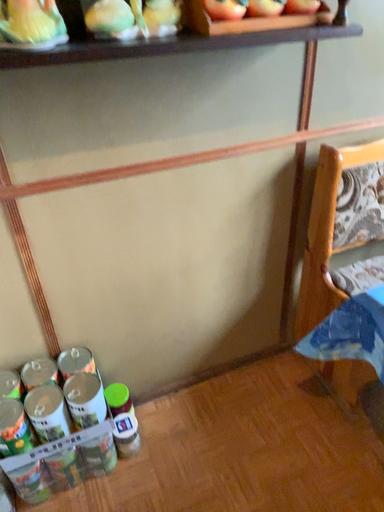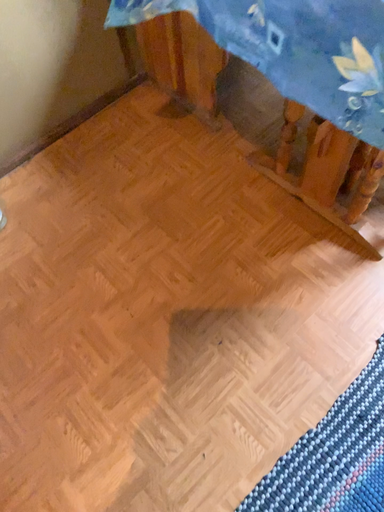
Question: How did the camera likely rotate when shooting the video?

Choices:
 (A) rotated upward
 (B) rotated downward

Answer: (B)